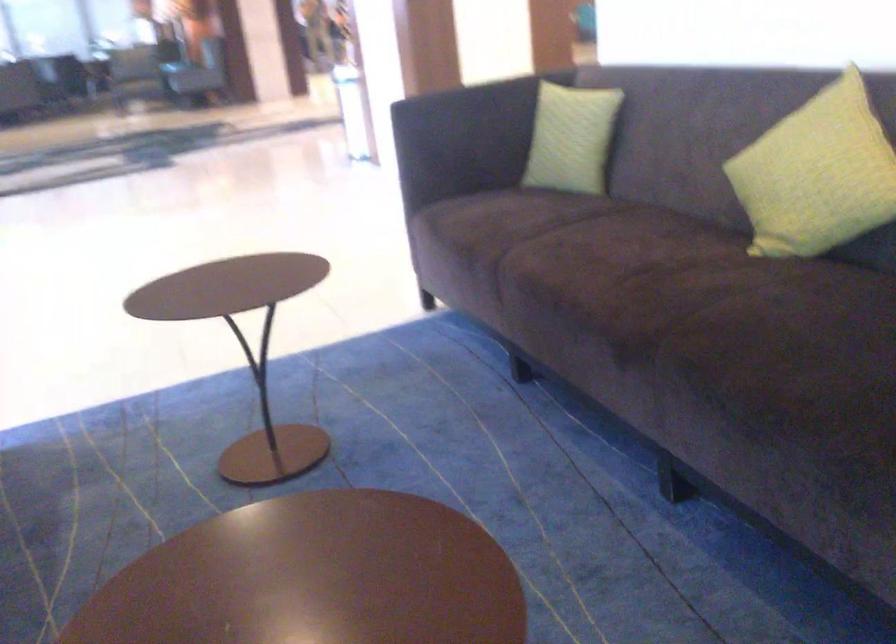
Identify the location of sofa armrest. The image size is (896, 644). 477,106.